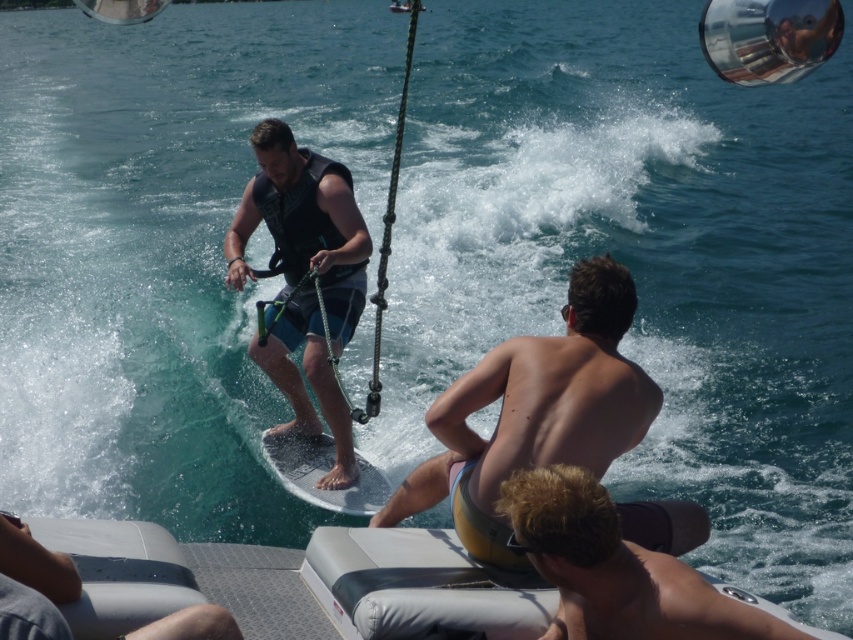
You are a photographer trying to capture a clear shot of both the smooth skin torso at center and the blonde hair at lower right. Based on their positions, which one is closer to the camera?

The smooth skin torso at center is closer to the camera because the blonde hair at lower right is behind it.

Based on the photo, you are a photographer trying to capture a clear shot of the dark blue fabric life vest at center and the blonde hair at lower right. Which object should you zoom in on to ensure both are in focus without changing the camera position?

The dark blue fabric life vest at center is bigger than blonde hair at lower right, so you should zoom in on the dark blue fabric life vest at center to ensure both are in focus.